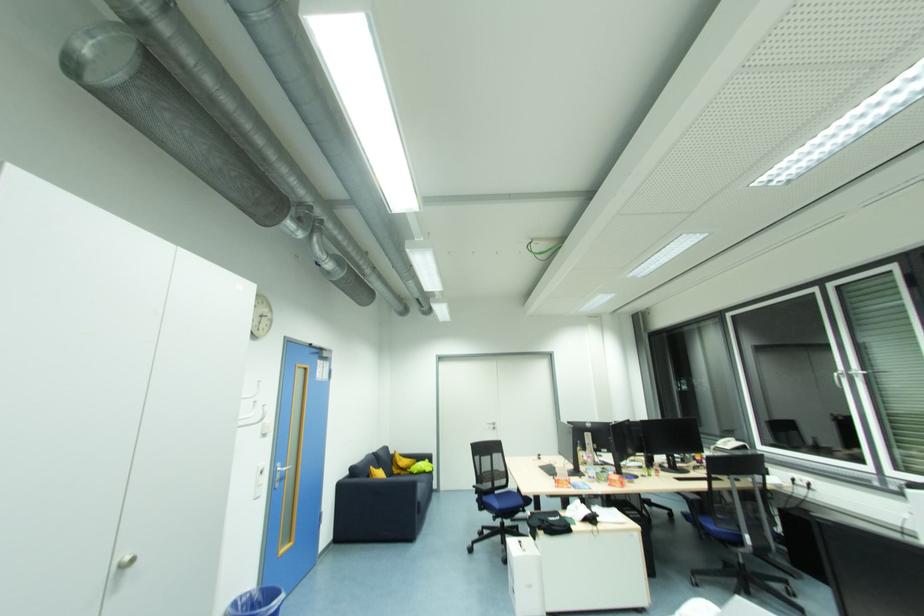
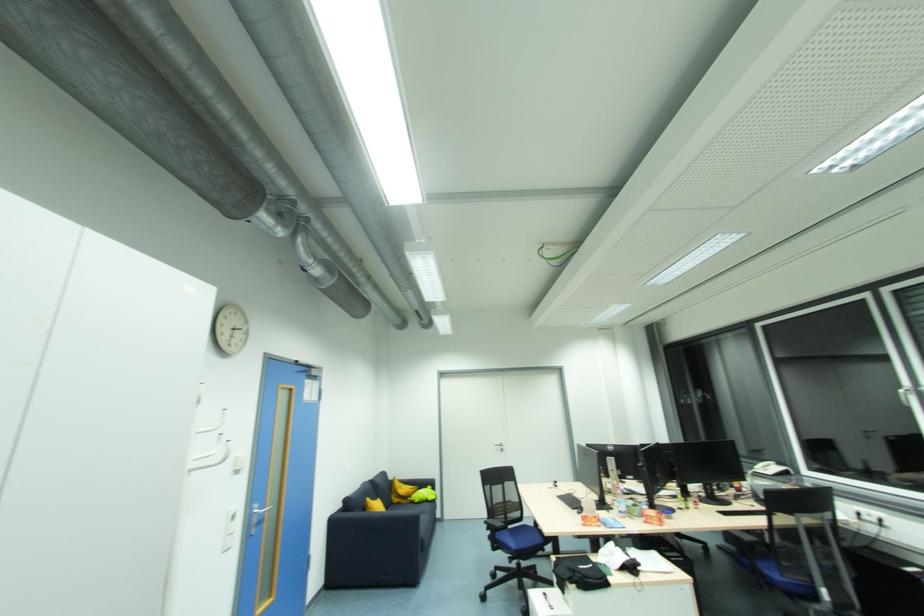
Where in the second image is the point corresponding to (x=285, y=472) from the first image?

(261, 517)